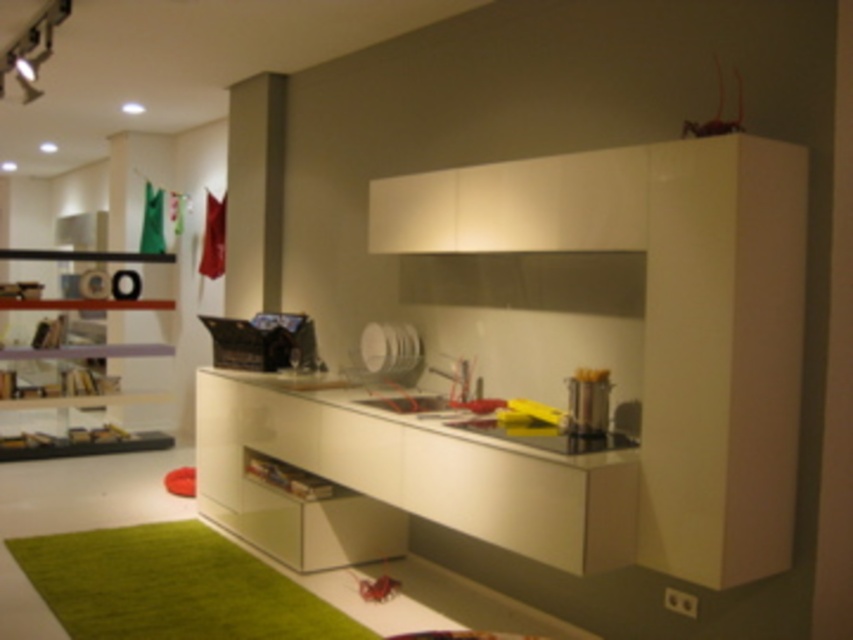
Is white glossy counter top at center positioned in front of satin silver pot at center?

Yes, white glossy counter top at center is closer to the viewer.

Who is more forward, (401, 468) or (573, 408)?

Positioned in front is point (573, 408).

Locate an element on the screen. The height and width of the screenshot is (640, 853). white glossy counter top at center is located at coordinates (403, 480).

Who is positioned more to the right, white glossy drawer at lower center or satin silver pot at center?

satin silver pot at center

Where is `white glossy drawer at lower center`? white glossy drawer at lower center is located at coordinates (293, 468).

Is point (311, 401) positioned after point (590, 385)?

That is True.

The image size is (853, 640). I want to click on white glossy drawer at lower center, so click(x=293, y=468).

Does white glossy counter top at center have a lesser width compared to white glossy drawer at lower center?

No.

Can you confirm if white glossy counter top at center is wider than white glossy drawer at lower center?

Yes.

Is point (502, 451) positioned after point (218, 465)?

No, (502, 451) is closer to viewer.

Locate an element on the screen. white glossy counter top at center is located at coordinates (403, 480).